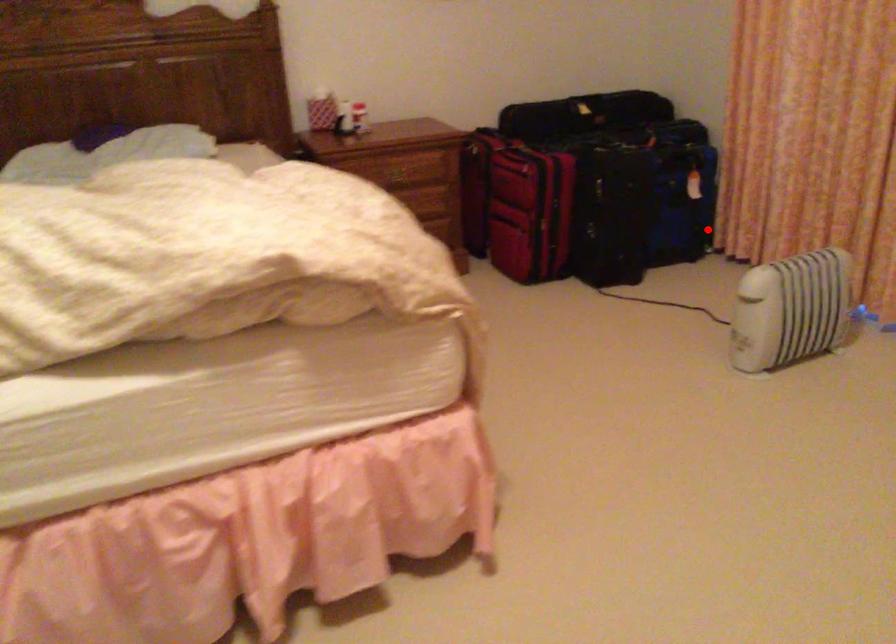
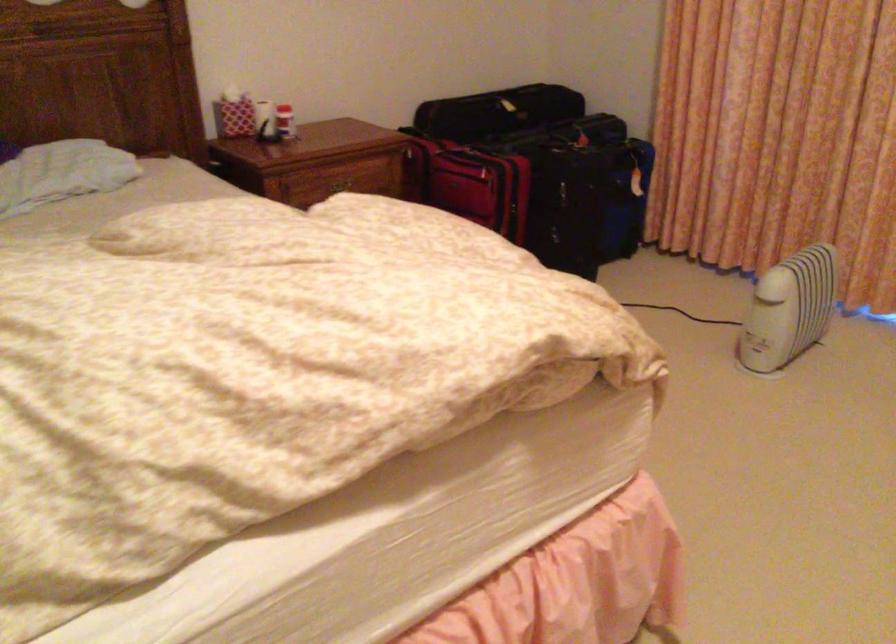
Locate, in the second image, the point that corresponds to the highlighted location in the first image.

(649, 223)